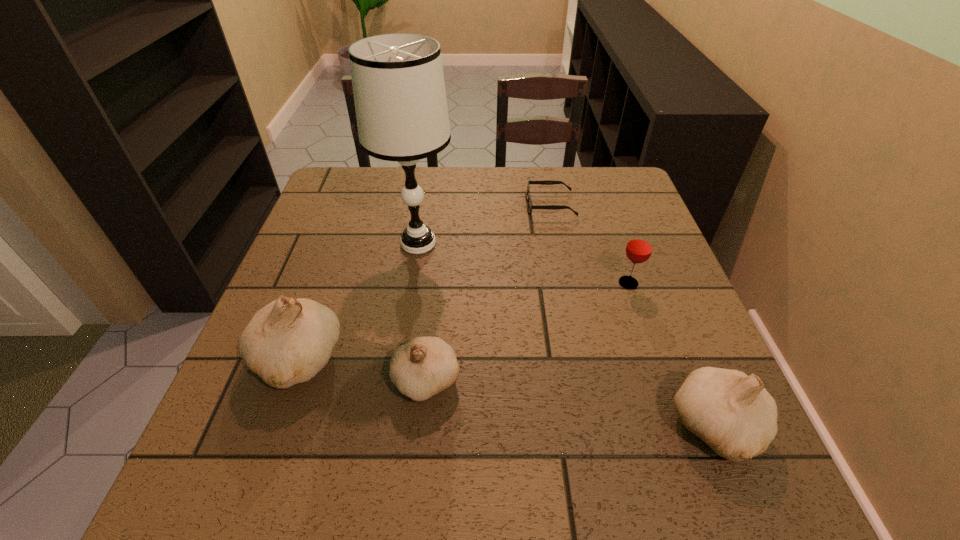
Find the location of a particular element. The height and width of the screenshot is (540, 960). object situated at the near left corner is located at coordinates (287, 342).

At what (x,y) coordinates should I click in order to perform the action: click on object at the near right corner. Please return your answer as a coordinate pair (x, y). This screenshot has width=960, height=540. Looking at the image, I should click on 733,413.

The height and width of the screenshot is (540, 960). In the image, there is a desktop. In order to click on free space at the far edge in this screenshot , I will do `click(472, 180)`.

The height and width of the screenshot is (540, 960). In the image, there is a desktop. Find the location of `vacant space at the near edge`. vacant space at the near edge is located at coordinates (307, 433).

Identify the location of vacant space at the left edge. (292, 273).

The height and width of the screenshot is (540, 960). In order to click on blank space at the right edge of the desktop in this screenshot , I will do `click(710, 347)`.

Where is `vacant space at the far left corner`? The width and height of the screenshot is (960, 540). vacant space at the far left corner is located at coordinates (372, 169).

In order to click on free space at the near left corner of the desktop in this screenshot , I will do `click(215, 435)`.

Where is `free spot between the glass and the leftmost garlic`? The image size is (960, 540). free spot between the glass and the leftmost garlic is located at coordinates (464, 322).

Find the location of a particular element. Image resolution: width=960 pixels, height=540 pixels. free area in between the tallest object and the rightmost garlic is located at coordinates (567, 335).